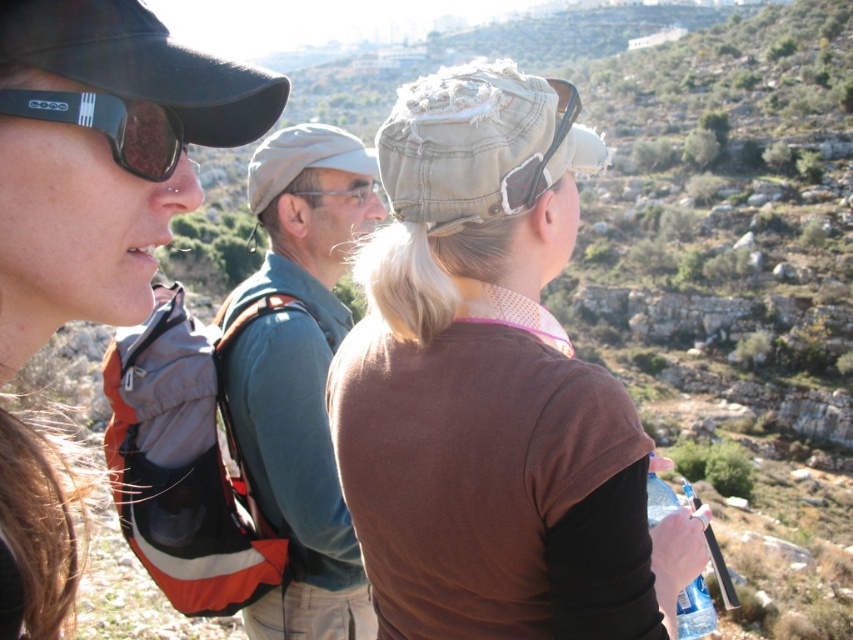
Is brown cotton shirt at center closer to camera compared to clear plastic bottle at lower right?

Yes, brown cotton shirt at center is closer to the viewer.

Can you confirm if brown cotton shirt at center is smaller than clear plastic bottle at lower right?

Incorrect, brown cotton shirt at center is not smaller in size than clear plastic bottle at lower right.

Where is `brown cotton shirt at center`? The image size is (853, 640). brown cotton shirt at center is located at coordinates point(492,388).

Is brown cotton shirt at center wider than light gray fabric cap at center?

No.

Is brown cotton shirt at center positioned at the back of light gray fabric cap at center?

That is False.

Which is in front, point (572, 538) or point (317, 316)?

Point (572, 538) is more forward.

Find the location of a particular element. brown cotton shirt at center is located at coordinates (492, 388).

Is light gray fabric cap at center above clear plastic bottle at lower right?

Yes, light gray fabric cap at center is above clear plastic bottle at lower right.

Between point (318, 269) and point (699, 602), which one is positioned behind?

Positioned behind is point (318, 269).

Identify the location of light gray fabric cap at center. (300, 372).